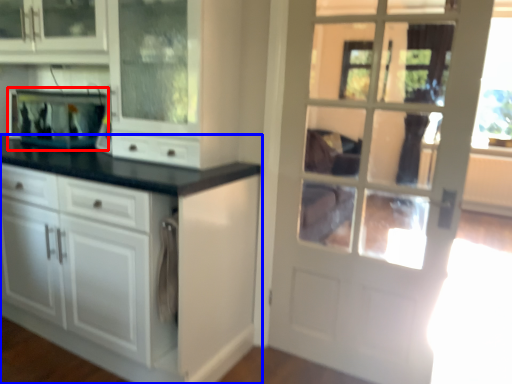
Question: Which of the following is the farthest to the observer, appliance (highlighted by a red box) or cabinetry (highlighted by a blue box)?

Choices:
 (A) appliance
 (B) cabinetry

Answer: (A)